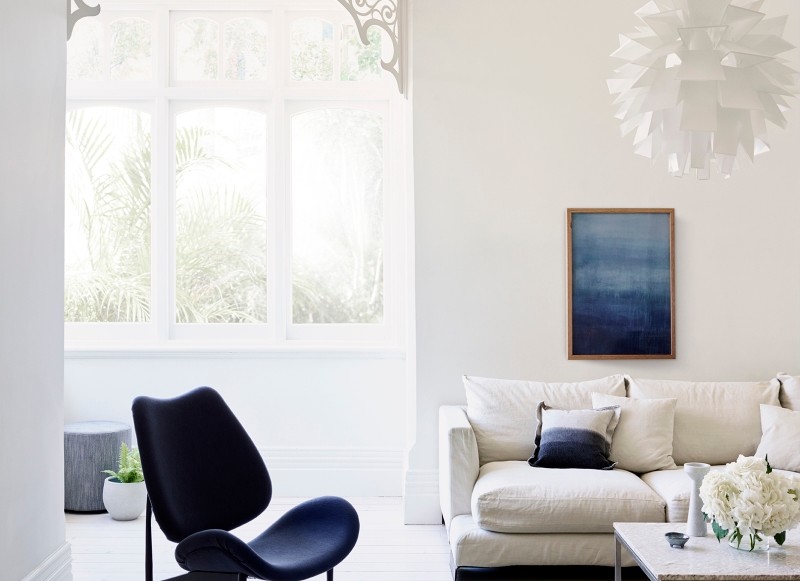
Where is `vase`? The image size is (800, 581). vase is located at coordinates (745, 546).